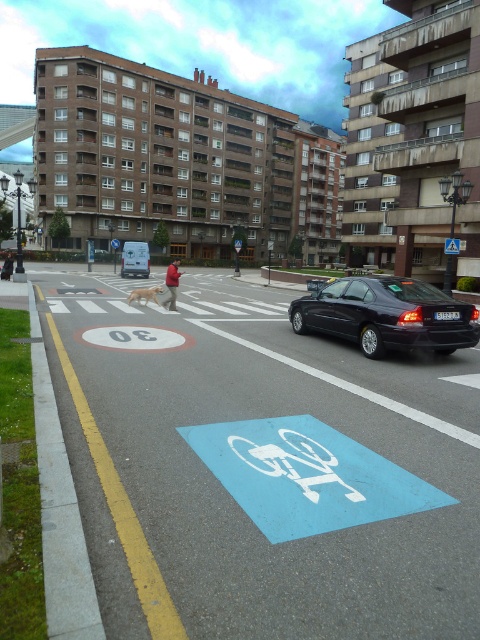
Question: Does blue painted bicycle sign at lower center appear over white plastic pedestrian crossing sign at upper center?

Choices:
 (A) yes
 (B) no

Answer: (B)

Question: Can you confirm if shiny black sedan at right is positioned below white plastic pedestrian crossing sign at upper center?

Choices:
 (A) yes
 (B) no

Answer: (A)

Question: Does shiny black sedan at right have a lesser width compared to golden fur dog at center?

Choices:
 (A) no
 (B) yes

Answer: (A)

Question: Which point is farther from the camera taking this photo?

Choices:
 (A) (454, 241)
 (B) (119, 243)
 (C) (145, 289)
 (D) (400, 435)

Answer: (B)

Question: Which of the following is the farthest from the observer?

Choices:
 (A) (133, 464)
 (B) (342, 333)

Answer: (B)

Question: Based on their relative distances, which object is nearer to the white plastic pedestrian crossing sign at upper center?

Choices:
 (A) shiny black sedan at right
 (B) red cotton shirt at center
 (C) golden fur dog at center

Answer: (C)